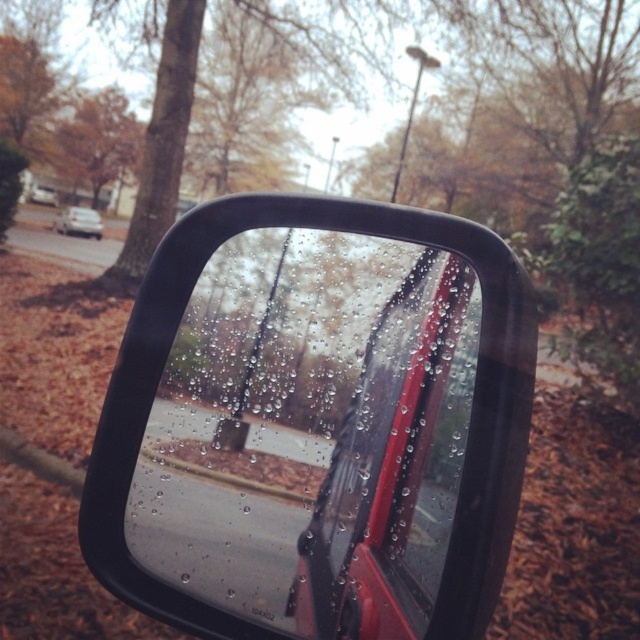
Is glossy plastic car mirror at center to the left of white matte sedan at left from the viewer's perspective?

No, glossy plastic car mirror at center is not to the left of white matte sedan at left.

Does point (259, 346) lie behind point (67, 224)?

No, (259, 346) is closer to viewer.

What do you see at coordinates (316, 422) in the screenshot?
I see `glossy plastic car mirror at center` at bounding box center [316, 422].

Where is `glossy plastic car mirror at center`? This screenshot has height=640, width=640. glossy plastic car mirror at center is located at coordinates tap(316, 422).